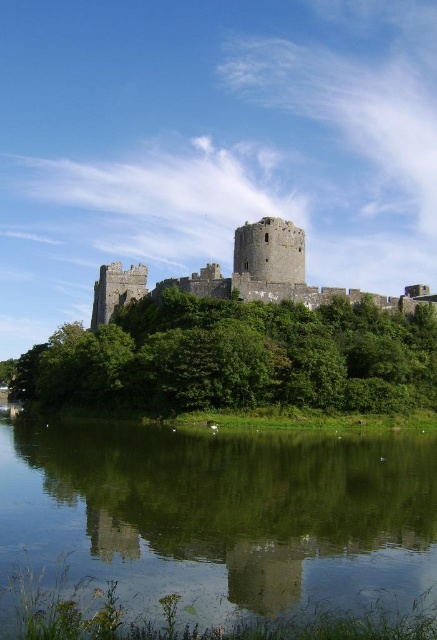
Question: Is green reflective water at lower center further to camera compared to stone medieval castle at center?

Choices:
 (A) yes
 (B) no

Answer: (B)

Question: Does green reflective water at lower center have a smaller size compared to stone medieval castle at center?

Choices:
 (A) no
 (B) yes

Answer: (B)

Question: Does green reflective water at lower center appear on the right side of stone medieval castle at center?

Choices:
 (A) no
 (B) yes

Answer: (A)

Question: Which point is farther to the camera?

Choices:
 (A) stone medieval castle at center
 (B) green reflective water at lower center

Answer: (A)